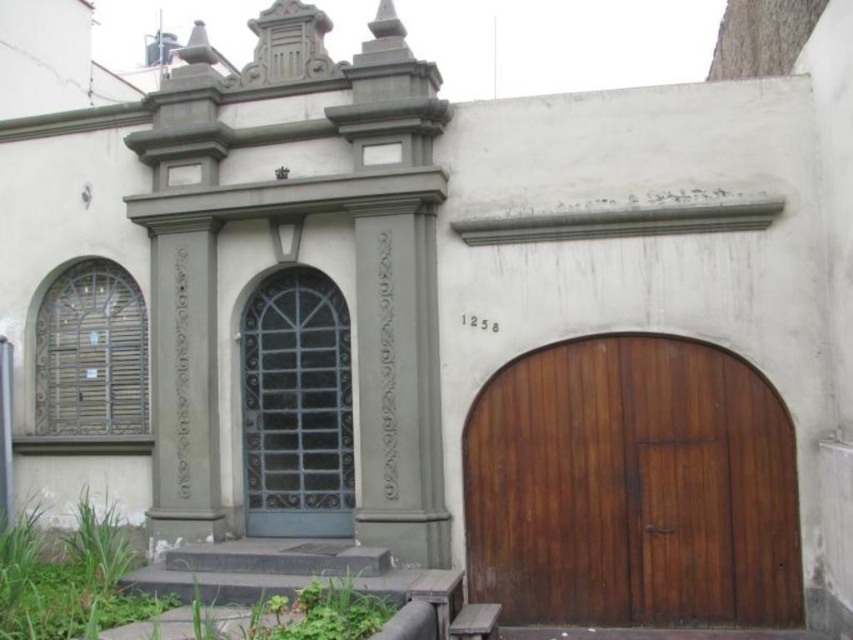
Question: Does dark brown wood garage door at center have a greater width compared to matte gray door at center?

Choices:
 (A) yes
 (B) no

Answer: (A)

Question: Does dark brown wood garage door at center appear over matte gray door at center?

Choices:
 (A) yes
 (B) no

Answer: (B)

Question: Among these objects, which one is nearest to the camera?

Choices:
 (A) dark brown wood garage door at center
 (B) matte gray door at center

Answer: (A)

Question: Which point is closer to the camera?

Choices:
 (A) matte gray door at center
 (B) dark brown wood garage door at center

Answer: (B)

Question: Which point appears farthest from the camera in this image?

Choices:
 (A) (281, 420)
 (B) (761, 384)

Answer: (A)

Question: Is dark brown wood garage door at center bigger than matte gray door at center?

Choices:
 (A) no
 (B) yes

Answer: (B)